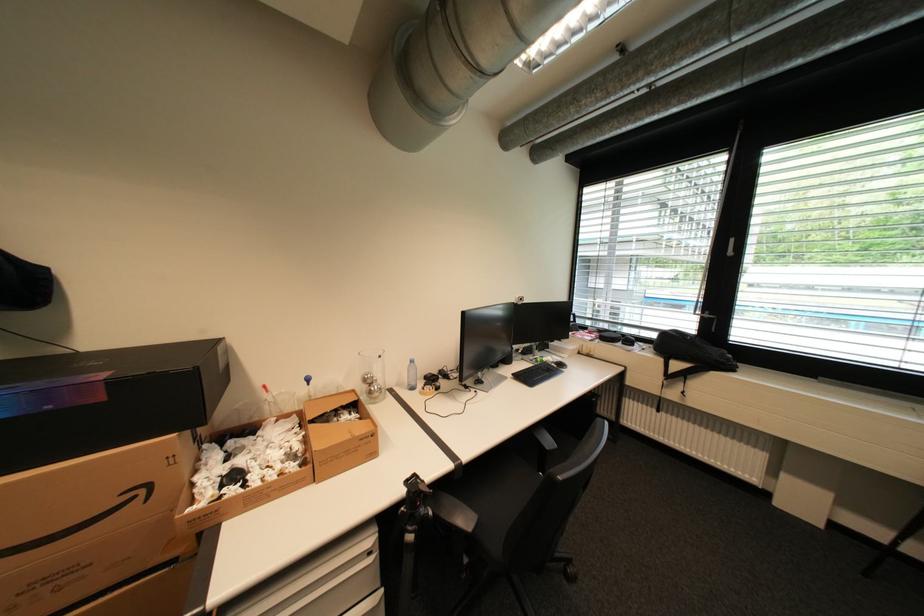
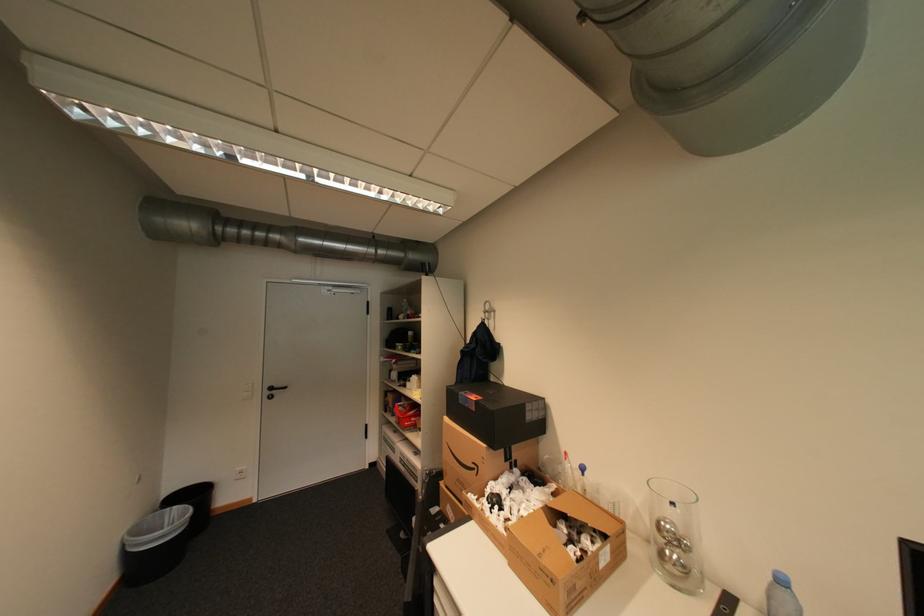
The point at (419, 362) is marked in the first image. Where is the corresponding point in the second image?

(791, 582)